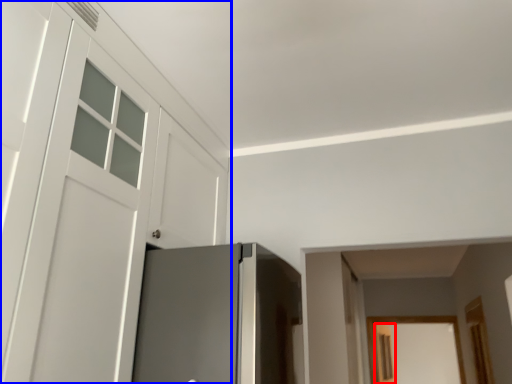
Question: Which object appears farthest to the camera in this image, screen door (highlighted by a red box) or door (highlighted by a blue box)?

Choices:
 (A) screen door
 (B) door

Answer: (A)